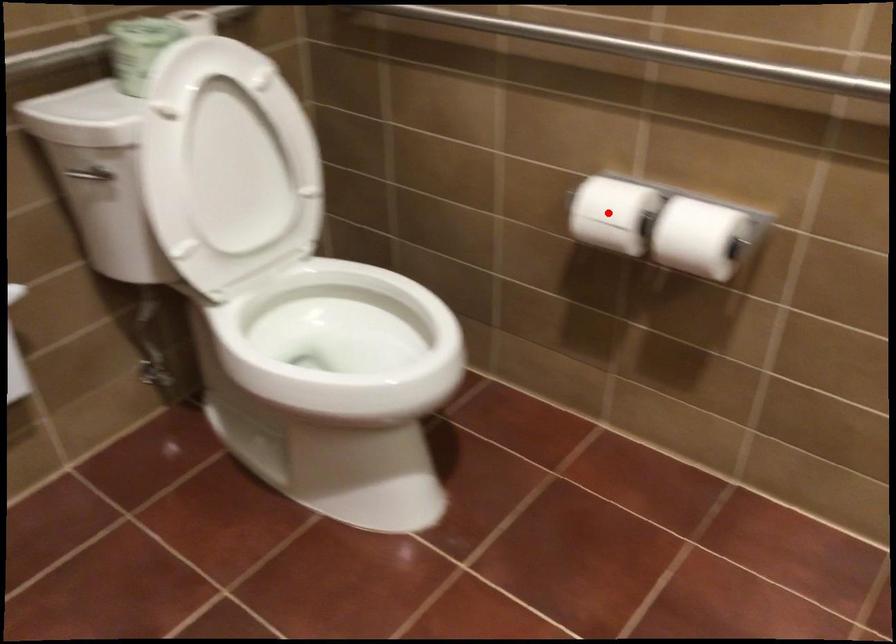
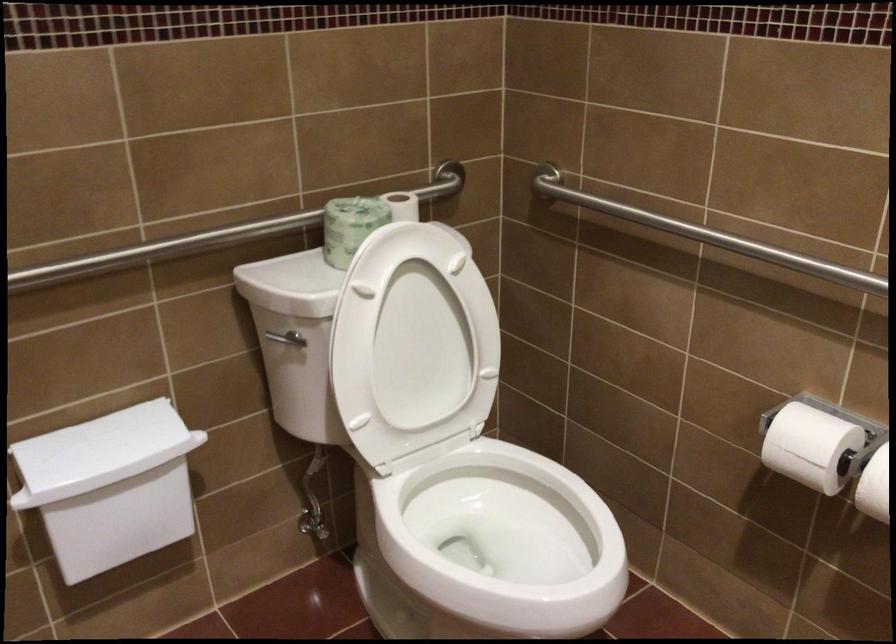
In the second image, find the point that corresponds to the highlighted location in the first image.

(810, 446)